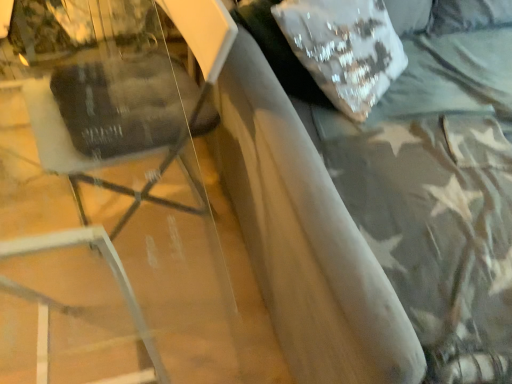
Question: Can you confirm if white sequined pillow at upper right is thinner than suede-like gray bed at upper right?

Choices:
 (A) no
 (B) yes

Answer: (B)

Question: From the image's perspective, is white sequined pillow at upper right above suede-like gray bed at upper right?

Choices:
 (A) no
 (B) yes

Answer: (B)

Question: Is white sequined pillow at upper right not near suede-like gray bed at upper right?

Choices:
 (A) no
 (B) yes

Answer: (A)

Question: Does white sequined pillow at upper right appear on the right side of suede-like gray bed at upper right?

Choices:
 (A) yes
 (B) no

Answer: (B)

Question: From the image's perspective, is white sequined pillow at upper right beneath suede-like gray bed at upper right?

Choices:
 (A) no
 (B) yes

Answer: (A)

Question: Considering the relative sizes of white sequined pillow at upper right and suede-like gray bed at upper right in the image provided, is white sequined pillow at upper right taller than suede-like gray bed at upper right?

Choices:
 (A) no
 (B) yes

Answer: (A)

Question: Could you tell me if suede-like gray bed at upper right is turned towards white sequined pillow at upper right?

Choices:
 (A) yes
 (B) no

Answer: (B)

Question: Is suede-like gray bed at upper right next to white sequined pillow at upper right and touching it?

Choices:
 (A) no
 (B) yes

Answer: (A)

Question: Is there a large distance between suede-like gray bed at upper right and white sequined pillow at upper right?

Choices:
 (A) no
 (B) yes

Answer: (A)

Question: From a real-world perspective, is suede-like gray bed at upper right on white sequined pillow at upper right?

Choices:
 (A) no
 (B) yes

Answer: (A)

Question: Considering the relative sizes of suede-like gray bed at upper right and white sequined pillow at upper right in the image provided, is suede-like gray bed at upper right smaller than white sequined pillow at upper right?

Choices:
 (A) yes
 (B) no

Answer: (B)

Question: Is suede-like gray bed at upper right shorter than white sequined pillow at upper right?

Choices:
 (A) no
 (B) yes

Answer: (A)

Question: Is matte black swivel chair at left facing away from suede-like gray bed at upper right?

Choices:
 (A) no
 (B) yes

Answer: (B)